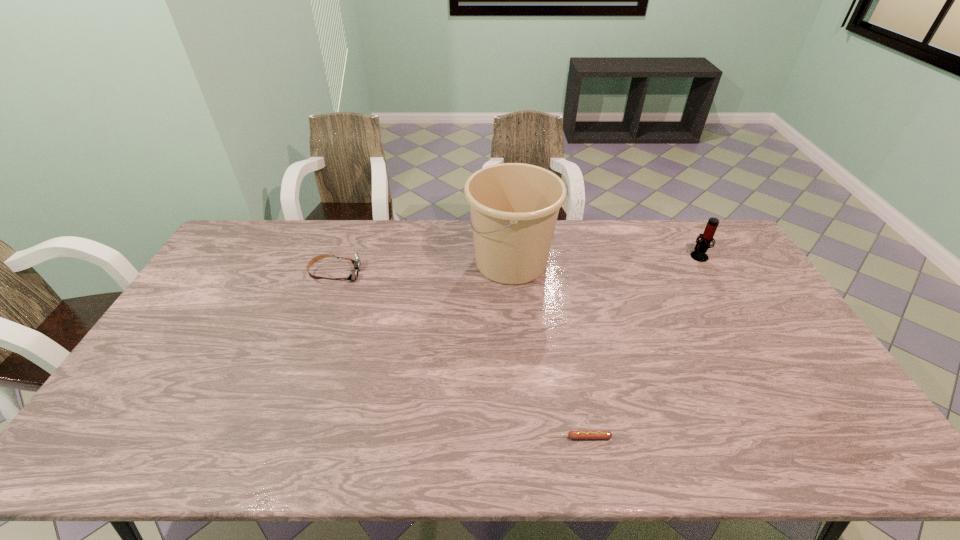
Find the location of `the tallest object`. the tallest object is located at coordinates (514, 207).

Identify the location of the third shortest object. (702, 245).

This screenshot has height=540, width=960. Find the location of `microphone`. microphone is located at coordinates (702, 245).

This screenshot has width=960, height=540. In order to click on the second shortest object in this screenshot , I will do `click(354, 274)`.

Where is `the leftmost object`? the leftmost object is located at coordinates (354, 274).

You are a GUI agent. You are given a task and a screenshot of the screen. Output one action in this format:
    pyautogui.click(x=<x>, y=<y>)
    Task: Click on the nearest object
    The height and width of the screenshot is (540, 960).
    Given the screenshot: What is the action you would take?
    pyautogui.click(x=571, y=434)

Find the location of a particular element. sausage is located at coordinates (571, 434).

The image size is (960, 540). In order to click on vacant area situated 0.150m on the right of the tallest object in this screenshot , I will do `click(599, 261)`.

Identify the location of free spot located 0.360m on the left of the rightmost object. The width and height of the screenshot is (960, 540). (588, 255).

Where is `vacant point located on the front-facing side of the goggles`? This screenshot has width=960, height=540. vacant point located on the front-facing side of the goggles is located at coordinates (466, 273).